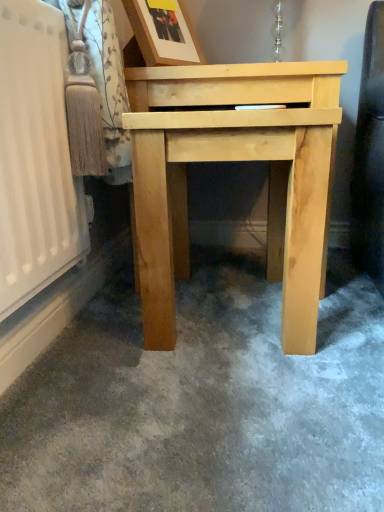
The width and height of the screenshot is (384, 512). I want to click on wooden picture frame at upper center, so click(x=163, y=32).

What do you see at coordinates (163, 32) in the screenshot? This screenshot has width=384, height=512. I see `wooden picture frame at upper center` at bounding box center [163, 32].

The height and width of the screenshot is (512, 384). Describe the element at coordinates (235, 160) in the screenshot. I see `natural wood table at center` at that location.

Locate an element on the screen. The width and height of the screenshot is (384, 512). natural wood table at center is located at coordinates (235, 160).

Looking at this image, measure the distance between point (299,311) and camera.

The distance of point (299,311) from camera is 34.41 inches.

Identify the location of wooden picture frame at upper center. coord(163,32).

Between wooden picture frame at upper center and natural wood table at center, which one appears on the right side from the viewer's perspective?

natural wood table at center is more to the right.

In the image, is wooden picture frame at upper center positioned in front of or behind natural wood table at center?

In the image, wooden picture frame at upper center appears behind natural wood table at center.

Between point (189, 64) and point (184, 234), which one is positioned behind?

Point (184, 234)

From the image's perspective, between wooden picture frame at upper center and natural wood table at center, which one is located above?

wooden picture frame at upper center is shown above in the image.

From a real-world perspective, which object stands above the other?

wooden picture frame at upper center.

Considering the relative sizes of wooden picture frame at upper center and natural wood table at center in the image provided, is wooden picture frame at upper center wider than natural wood table at center?

No.

Who is shorter, wooden picture frame at upper center or natural wood table at center?

Standing shorter between the two is wooden picture frame at upper center.

Based on their sizes in the image, would you say wooden picture frame at upper center is bigger or smaller than natural wood table at center?

Considering their sizes, wooden picture frame at upper center takes up less space than natural wood table at center.

Would you say wooden picture frame at upper center contains natural wood table at center?

No, natural wood table at center is not inside wooden picture frame at upper center.

Is wooden picture frame at upper center not close to natural wood table at center?

wooden picture frame at upper center is actually quite close to natural wood table at center.

Based on the photo, is wooden picture frame at upper center positioned with its back to natural wood table at center?

No, natural wood table at center is not at the back of wooden picture frame at upper center.

What's the angular difference between wooden picture frame at upper center and natural wood table at center's facing directions?

There is a 58.5-degree angle between the facing directions of wooden picture frame at upper center and natural wood table at center.

How far apart are wooden picture frame at upper center and natural wood table at center?

wooden picture frame at upper center and natural wood table at center are 33.08 centimeters apart.

Identify the location of table below the wooden picture frame at upper center (from a real-world perspective). This screenshot has width=384, height=512. (235, 160).

Which object is positioned more to the right, natural wood table at center or wooden picture frame at upper center?

Positioned to the right is natural wood table at center.

In the image, is natural wood table at center positioned in front of or behind wooden picture frame at upper center?

In the image, natural wood table at center appears in front of wooden picture frame at upper center.

Which is in front, point (142, 112) or point (153, 7)?

The point (142, 112) is closer to the camera.

From the image's perspective, which is below, natural wood table at center or wooden picture frame at upper center?

From the image's view, natural wood table at center is below.

From a real-world perspective, is natural wood table at center on top of wooden picture frame at upper center?

No, from a real-world perspective, natural wood table at center is not over wooden picture frame at upper center

Is natural wood table at center wider than wooden picture frame at upper center?

Yes, natural wood table at center is wider than wooden picture frame at upper center.

Between natural wood table at center and wooden picture frame at upper center, which one has more height?

Standing taller between the two is natural wood table at center.

Which of these two, natural wood table at center or wooden picture frame at upper center, is smaller?

Smaller between the two is wooden picture frame at upper center.

Is wooden picture frame at upper center a part of natural wood table at center?

No, wooden picture frame at upper center is not inside natural wood table at center.

Are natural wood table at center and wooden picture frame at upper center located far from each other?

natural wood table at center is near wooden picture frame at upper center, not far away.

Is natural wood table at center looking in the opposite direction of wooden picture frame at upper center?

No, natural wood table at center is not facing the opposite direction of wooden picture frame at upper center.

What's the angular difference between natural wood table at center and wooden picture frame at upper center's facing directions?

The angular difference between natural wood table at center and wooden picture frame at upper center is 58.5 degrees.

Identify the location of table below the wooden picture frame at upper center (from a real-world perspective). pyautogui.click(x=235, y=160).

I want to click on table on the right of wooden picture frame at upper center, so click(235, 160).

I want to click on table below the wooden picture frame at upper center (from a real-world perspective), so click(235, 160).